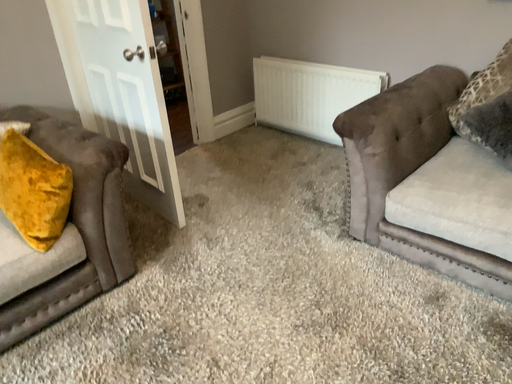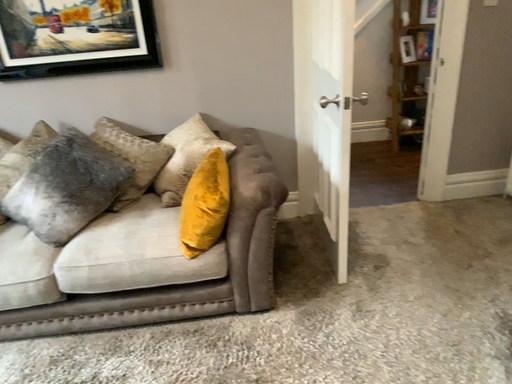
Question: Which way did the camera rotate in the video?

Choices:
 (A) rotated right
 (B) rotated left

Answer: (B)